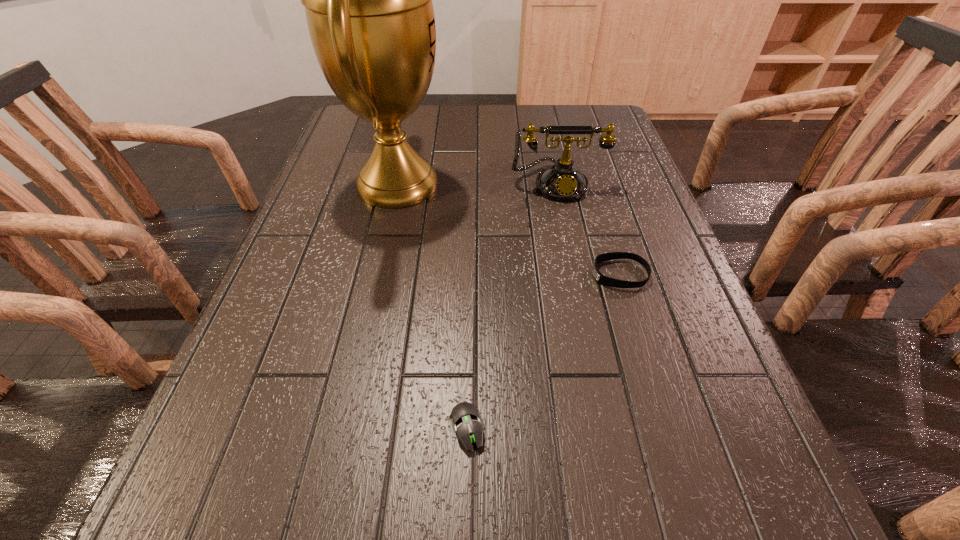
The height and width of the screenshot is (540, 960). I want to click on trophy cup, so click(x=368, y=0).

Identify the location of the tallest object. (368, 0).

What are the coordinates of `the second tallest object` in the screenshot? It's located at (562, 181).

The width and height of the screenshot is (960, 540). I want to click on the second nearest object, so click(x=600, y=278).

In order to click on the second shortest object in this screenshot , I will do `click(600, 278)`.

The height and width of the screenshot is (540, 960). What are the coordinates of `the shortest object` in the screenshot? It's located at (465, 420).

The image size is (960, 540). What are the coordinates of `the nearest object` in the screenshot? It's located at (465, 420).

You are a GUI agent. You are given a task and a screenshot of the screen. Output one action in this format:
    pyautogui.click(x=<x>, y=<y>)
    Task: Click on the vacant space located on the surface of the leftmost object with symbols
    This screenshot has height=540, width=960.
    Given the screenshot: What is the action you would take?
    pyautogui.click(x=568, y=184)

This screenshot has width=960, height=540. Identify the location of free space located 0.240m on the dial of the second tallest object. (576, 271).

This screenshot has width=960, height=540. In order to click on vacant region located 0.080m on the display of the third tallest object in this screenshot , I will do `click(554, 274)`.